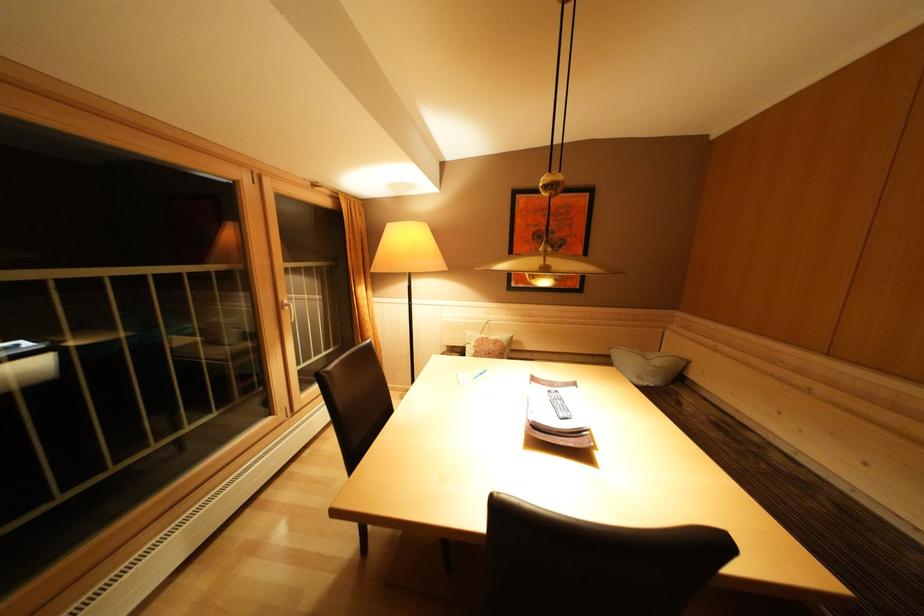
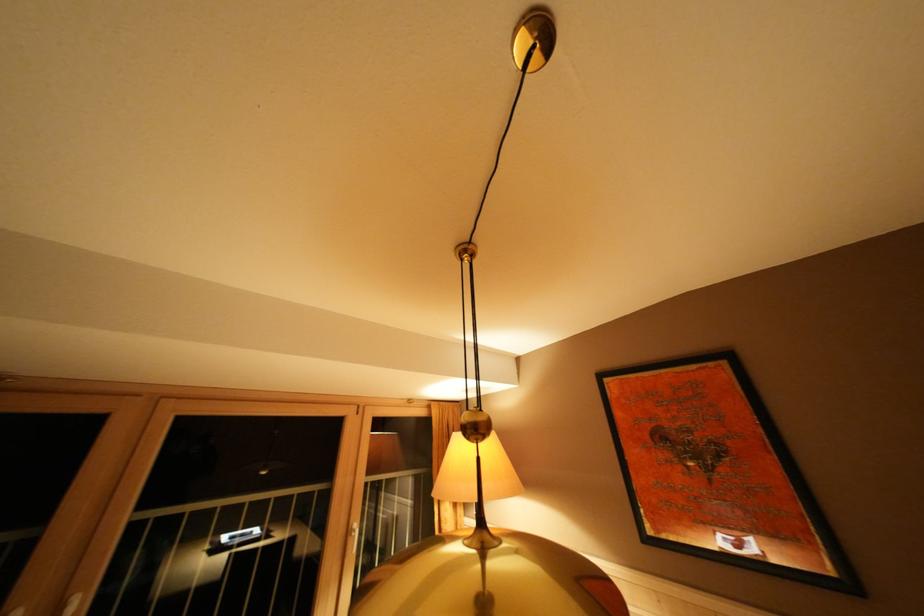
The images are taken continuously from a first-person perspective. In which direction is your viewpoint rotating?

The camera rotated toward left-up.